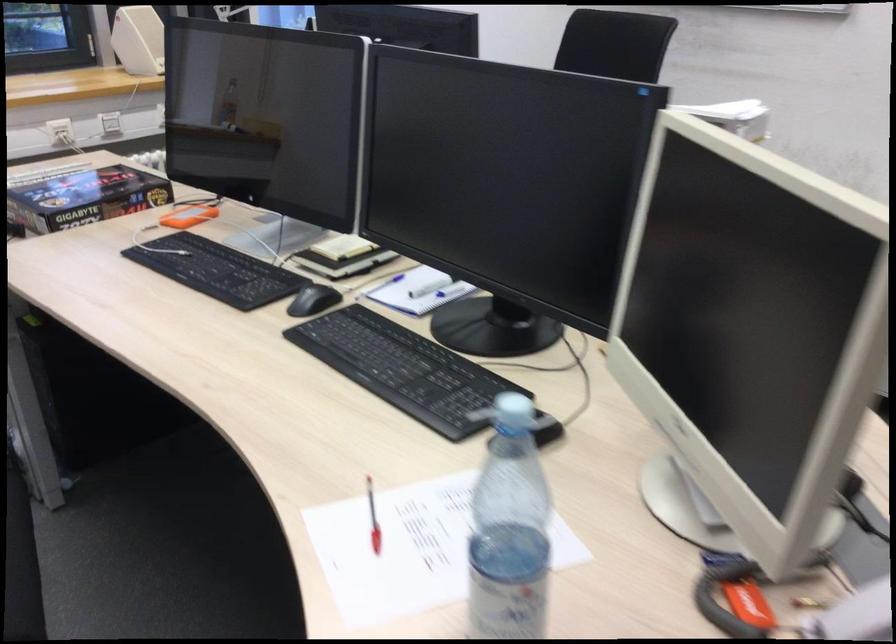
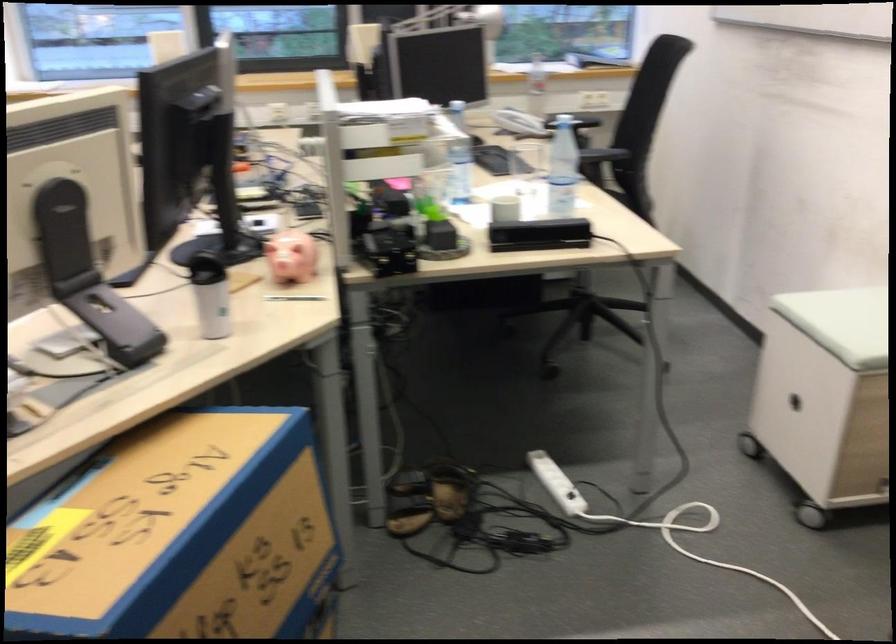
Question: I am providing you with two images of the same scene from different viewpoints. After the viewpoint changes to image2, which objects are now occluded?

Choices:
 (A) white wheeled stool
 (B) black product box
 (C) plastic water bottle
 (D) yellow ruler

Answer: (B)